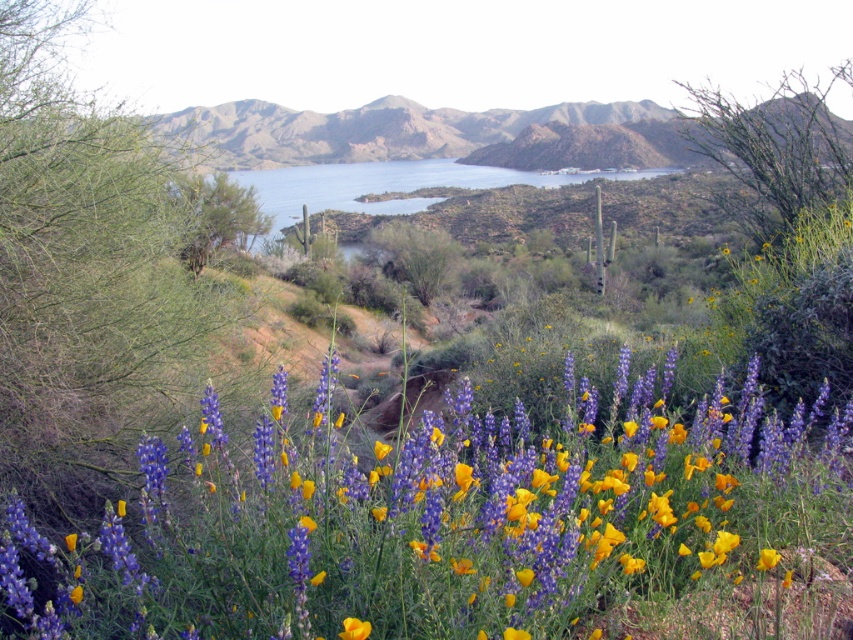
Does point (498, 509) come closer to viewer compared to point (347, 618)?

No, it is not.

Between point (198, 499) and point (357, 628), which one is positioned in front?

Point (357, 628)

The width and height of the screenshot is (853, 640). Describe the element at coordinates (454, 520) in the screenshot. I see `vibrant purple petals at center` at that location.

You are a GUI agent. You are given a task and a screenshot of the screen. Output one action in this format:
    pyautogui.click(x=<x>, y=<y>)
    Task: Click on the vibrant purple petals at center
    Image resolution: width=853 pixels, height=640 pixels.
    Given the screenshot: What is the action you would take?
    click(454, 520)

Between point (358, 540) and point (282, 189), which one is positioned in front?

Point (358, 540)

Between vibrant purple petals at center and blue water at center, which one appears on the right side from the viewer's perspective?

blue water at center

Is point (274, 612) closer to camera compared to point (614, 176)?

Yes, point (274, 612) is closer to viewer.

In order to click on vibrant purple petals at center in this screenshot , I will do `click(454, 520)`.

Does point (281, 209) lie in front of point (367, 625)?

No, it is not.

Which is in front, point (523, 180) or point (350, 634)?

Point (350, 634) is more forward.

This screenshot has height=640, width=853. What do you see at coordinates (389, 184) in the screenshot?
I see `blue water at center` at bounding box center [389, 184].

What are the coordinates of `blue water at center` in the screenshot? It's located at (389, 184).